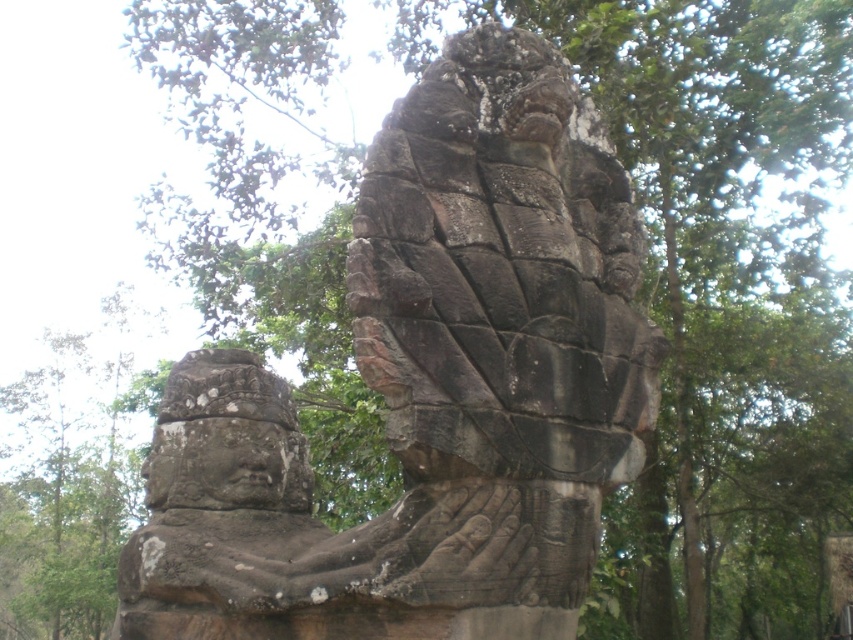
Based on the scene description, where is the rough stone sculpture at center located in terms of its 2D coordinates?

The rough stone sculpture at center is located at the 2D coordinates of point [439,384].